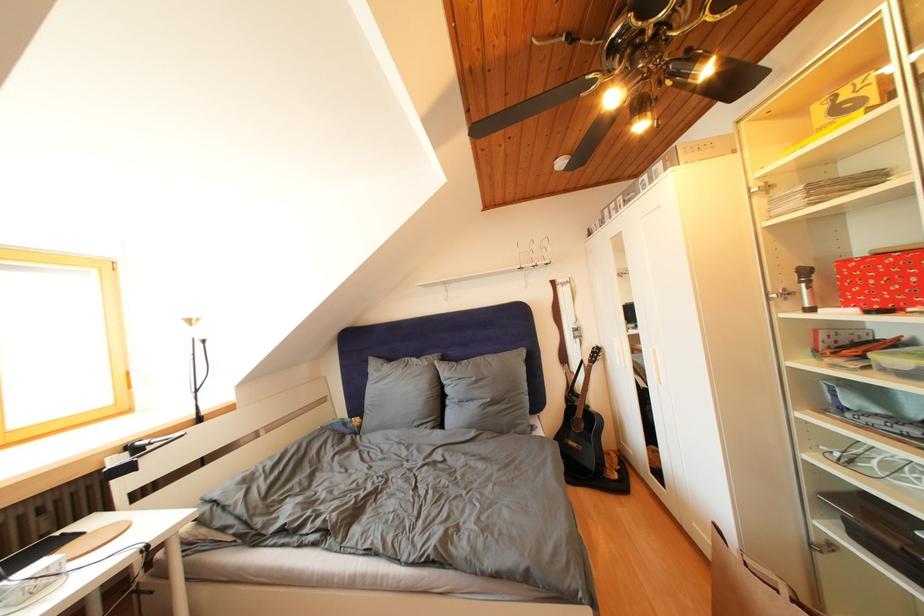
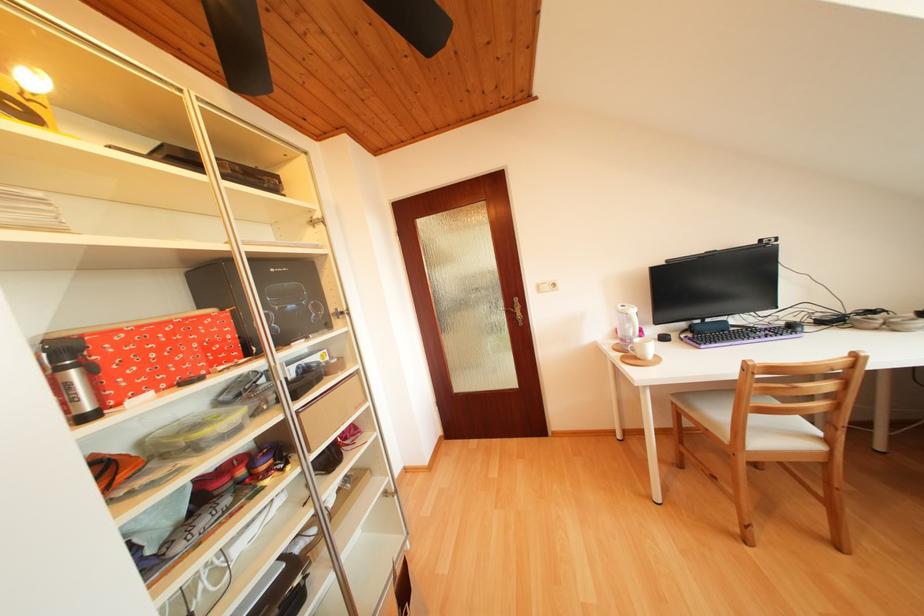
Find the pixel in the second image that matches (x=873, y=283) in the first image.

(151, 358)